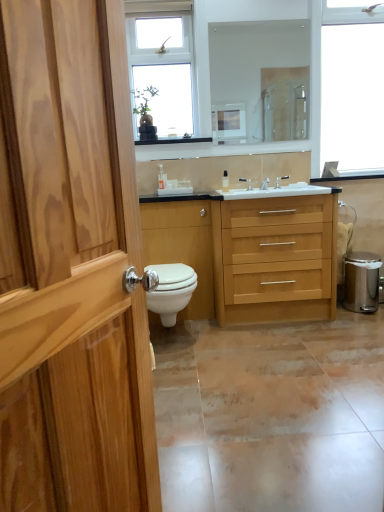
Question: In which direction should I rotate to look at clear plastic bottle at center, positioned as the second toiletry in right-to-left order?

Choices:
 (A) left
 (B) right

Answer: (A)

Question: Is silver metallic faucet at center, arranged as the 3th tap when viewed from the right, not near clear glass mirror at upper center?

Choices:
 (A) yes
 (B) no

Answer: (A)

Question: Does silver metallic faucet at center, arranged as the 3th tap when viewed from the right, have a lesser height compared to clear glass mirror at upper center?

Choices:
 (A) yes
 (B) no

Answer: (A)

Question: Considering the relative positions of silver metallic faucet at center, arranged as the 3th tap when viewed from the right, and clear glass mirror at upper center in the image provided, is silver metallic faucet at center, arranged as the 3th tap when viewed from the right, to the left of clear glass mirror at upper center from the viewer's perspective?

Choices:
 (A) no
 (B) yes

Answer: (B)

Question: Can you confirm if silver metallic faucet at center, positioned as the first tap in left-to-right order, is bigger than clear glass mirror at upper center?

Choices:
 (A) no
 (B) yes

Answer: (A)

Question: From the image's perspective, is silver metallic faucet at center, positioned as the first tap in left-to-right order, beneath clear glass mirror at upper center?

Choices:
 (A) yes
 (B) no

Answer: (A)

Question: Is silver metallic faucet at center, arranged as the 3th tap when viewed from the right, aimed at clear glass mirror at upper center?

Choices:
 (A) yes
 (B) no

Answer: (B)

Question: Could silver metallic faucet at center, arranged as the second tap when viewed from the right, be considered to be inside clear plastic bottle at center, the 1th toiletry in the left-to-right sequence?

Choices:
 (A) no
 (B) yes

Answer: (A)

Question: Does clear plastic bottle at center, the 1th toiletry in the left-to-right sequence, have a larger size compared to silver metallic faucet at center, marked as the 2th tap in a left-to-right arrangement?

Choices:
 (A) no
 (B) yes

Answer: (A)

Question: Is clear plastic bottle at center, the 1th toiletry in the left-to-right sequence, to the left of silver metallic faucet at center, arranged as the second tap when viewed from the right, from the viewer's perspective?

Choices:
 (A) no
 (B) yes

Answer: (B)

Question: Does clear plastic bottle at center, the 1th toiletry in the left-to-right sequence, have a smaller size compared to silver metallic faucet at center, arranged as the second tap when viewed from the right?

Choices:
 (A) yes
 (B) no

Answer: (A)

Question: From a real-world perspective, is clear plastic bottle at center, positioned as the second toiletry in right-to-left order, below silver metallic faucet at center, arranged as the second tap when viewed from the right?

Choices:
 (A) yes
 (B) no

Answer: (B)

Question: Is clear plastic bottle at center, the 1th toiletry in the left-to-right sequence, oriented away from silver metallic faucet at center, arranged as the second tap when viewed from the right?

Choices:
 (A) no
 (B) yes

Answer: (A)

Question: Can you confirm if silver metallic faucet at center, the first tap from the right, is shorter than matte ceramic tile at lower center?

Choices:
 (A) yes
 (B) no

Answer: (B)